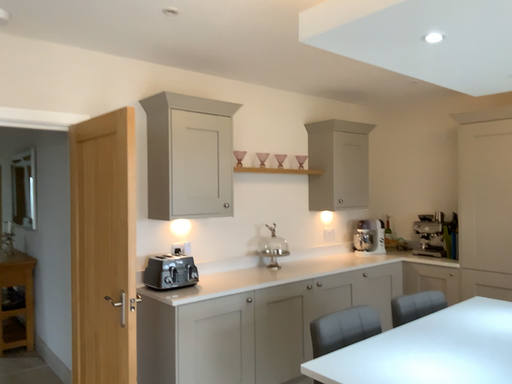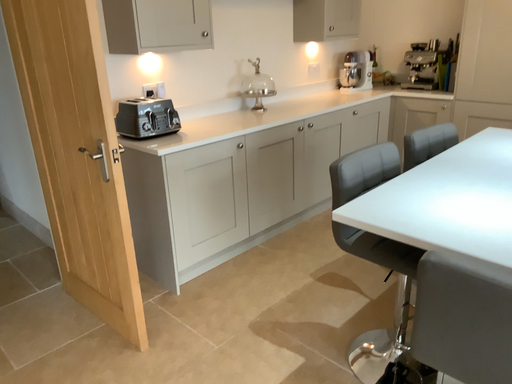
Question: How did the camera likely rotate when shooting the video?

Choices:
 (A) rotated upward
 (B) rotated downward

Answer: (B)